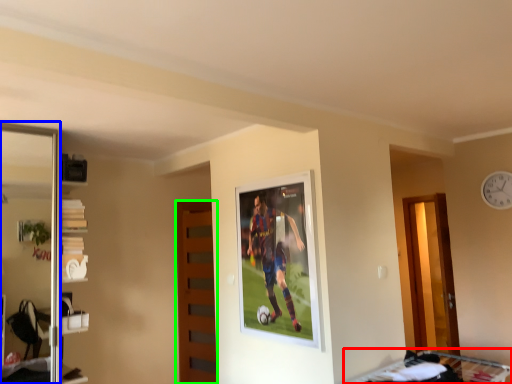
Question: Considering the real-world distances, which object is closest to bunk bed (highlighted by a red box)? screen door (highlighted by a blue box) or door (highlighted by a green box).

Choices:
 (A) screen door
 (B) door

Answer: (B)